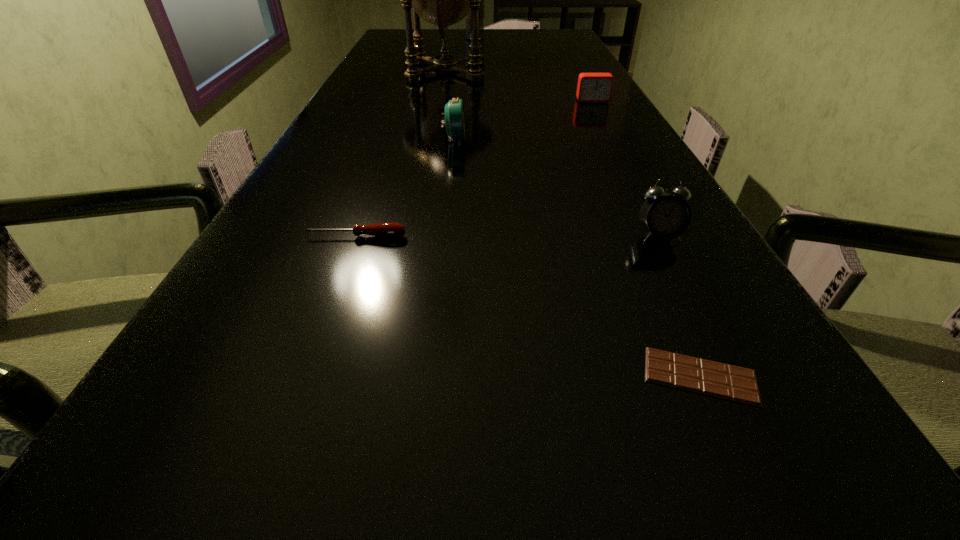
Locate an element on the screen. The width and height of the screenshot is (960, 540). the second farthest object is located at coordinates (442, 0).

You are a GUI agent. You are given a task and a screenshot of the screen. Output one action in this format:
    pyautogui.click(x=<x>, y=<y>)
    Task: Click on the tallest object
    The image size is (960, 540).
    Given the screenshot: What is the action you would take?
    pyautogui.click(x=442, y=0)

The width and height of the screenshot is (960, 540). I want to click on wine bottle, so click(481, 11).

This screenshot has height=540, width=960. What are the coordinates of `the sixth shortest object` in the screenshot? It's located at (481, 11).

At what (x,y) coordinates should I click in order to perform the action: click on the second farthest alarm clock. Please return your answer as a coordinate pair (x, y). Looking at the image, I should click on (454, 118).

Where is `the fourth nearest object`? The image size is (960, 540). the fourth nearest object is located at coordinates (454, 118).

I want to click on the nearest alarm clock, so click(x=666, y=216).

Locate an element on the screen. The height and width of the screenshot is (540, 960). the third farthest object is located at coordinates (592, 87).

Identify the location of the farthest alarm clock. The height and width of the screenshot is (540, 960). (592, 87).

The width and height of the screenshot is (960, 540). I want to click on screwdriver, so click(389, 229).